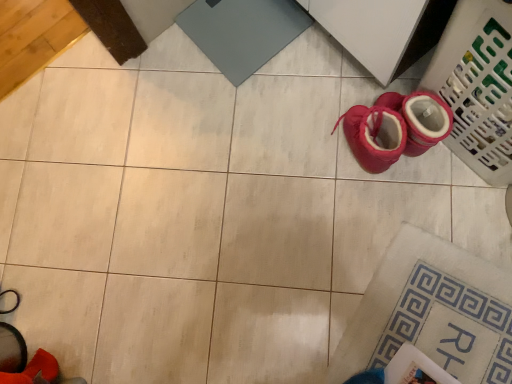
What do you see at coordinates (34, 370) in the screenshot?
I see `red suede boot at lower left` at bounding box center [34, 370].

Measure the distance between red suede boot at lower left and camera.

The depth of red suede boot at lower left is 33.74 inches.

Find the location of a particular element. red suede boot at lower left is located at coordinates (34, 370).

You are a GUI agent. You are given a task and a screenshot of the screen. Output one action in this format:
    pyautogui.click(x=<x>, y=<y>)
    Task: Click on the plastic laundry basket at lower right
    This screenshot has height=384, width=512.
    Given the screenshot: What is the action you would take?
    pyautogui.click(x=477, y=86)

The height and width of the screenshot is (384, 512). What do you see at coordinates (477, 86) in the screenshot? I see `plastic laundry basket at lower right` at bounding box center [477, 86].

Find the location of a particular element. red suede boot at lower left is located at coordinates (34, 370).

Considering the relative positions of plastic laundry basket at lower right and red suede boot at lower left in the image provided, is plastic laundry basket at lower right to the left or to the right of red suede boot at lower left?

In the image, plastic laundry basket at lower right appears on the right side of red suede boot at lower left.

Which object is further away from the camera taking this photo, plastic laundry basket at lower right or red suede boot at lower left?

plastic laundry basket at lower right.

Does point (497, 174) appear closer or farther from the camera than point (23, 379)?

Point (497, 174) appears to be farther away from the viewer than point (23, 379).

From the image's perspective, is plastic laundry basket at lower right located above or below red suede boot at lower left?

Clearly, from the image's perspective, plastic laundry basket at lower right is above red suede boot at lower left.

From a real-world perspective, which object rests below the other?

In real-world perspective, plastic laundry basket at lower right is lower.

Is plastic laundry basket at lower right thinner than red suede boot at lower left?

Incorrect, the width of plastic laundry basket at lower right is not less than that of red suede boot at lower left.

Considering the sizes of objects plastic laundry basket at lower right and red suede boot at lower left in the image provided, who is shorter, plastic laundry basket at lower right or red suede boot at lower left?

Standing shorter between the two is red suede boot at lower left.

Which of these two, plastic laundry basket at lower right or red suede boot at lower left, is bigger?

plastic laundry basket at lower right is bigger.

Is plastic laundry basket at lower right not within red suede boot at lower left?

Yes, plastic laundry basket at lower right is located beyond the bounds of red suede boot at lower left.

Is there a large distance between plastic laundry basket at lower right and red suede boot at lower left?

Indeed, plastic laundry basket at lower right is not near red suede boot at lower left.

Is plastic laundry basket at lower right oriented towards red suede boot at lower left?

Yes, plastic laundry basket at lower right is aimed at red suede boot at lower left.

I want to click on footwear above the plastic laundry basket at lower right (from a real-world perspective), so click(x=34, y=370).

Would you say red suede boot at lower left is to the left or to the right of plastic laundry basket at lower right in the picture?

Clearly, red suede boot at lower left is on the left of plastic laundry basket at lower right in the image.

Relative to plastic laundry basket at lower right, is red suede boot at lower left in front or behind?

Clearly, red suede boot at lower left is in front of plastic laundry basket at lower right.

Is point (45, 367) behind point (503, 96)?

That is True.

From the image's perspective, is red suede boot at lower left located above plastic laundry basket at lower right?

Actually, red suede boot at lower left appears below plastic laundry basket at lower right in the image.

From the picture: From a real-world perspective, does red suede boot at lower left stand above plastic laundry basket at lower right?

Yes.

Can you confirm if red suede boot at lower left is thinner than plastic laundry basket at lower right?

Indeed, red suede boot at lower left has a lesser width compared to plastic laundry basket at lower right.

Is red suede boot at lower left shorter than plastic laundry basket at lower right?

Correct, red suede boot at lower left is not as tall as plastic laundry basket at lower right.

From the picture: Does red suede boot at lower left have a smaller size compared to plastic laundry basket at lower right?

Correct, red suede boot at lower left occupies less space than plastic laundry basket at lower right.

Can plastic laundry basket at lower right be found inside red suede boot at lower left?

That's incorrect, plastic laundry basket at lower right is not inside red suede boot at lower left.

Is red suede boot at lower left placed right next to plastic laundry basket at lower right?

No, red suede boot at lower left is not making contact with plastic laundry basket at lower right.

Is red suede boot at lower left looking in the opposite direction of plastic laundry basket at lower right?

No.

How far apart are red suede boot at lower left and plastic laundry basket at lower right?

1.15 meters.

The image size is (512, 384). I want to click on laundry basket located behind the red suede boot at lower left, so click(477, 86).

Find the location of a particular element. This screenshot has height=384, width=512. laundry basket behind the red suede boot at lower left is located at coordinates (477, 86).

Identify the location of footwear on the left of plastic laundry basket at lower right. The width and height of the screenshot is (512, 384). (34, 370).